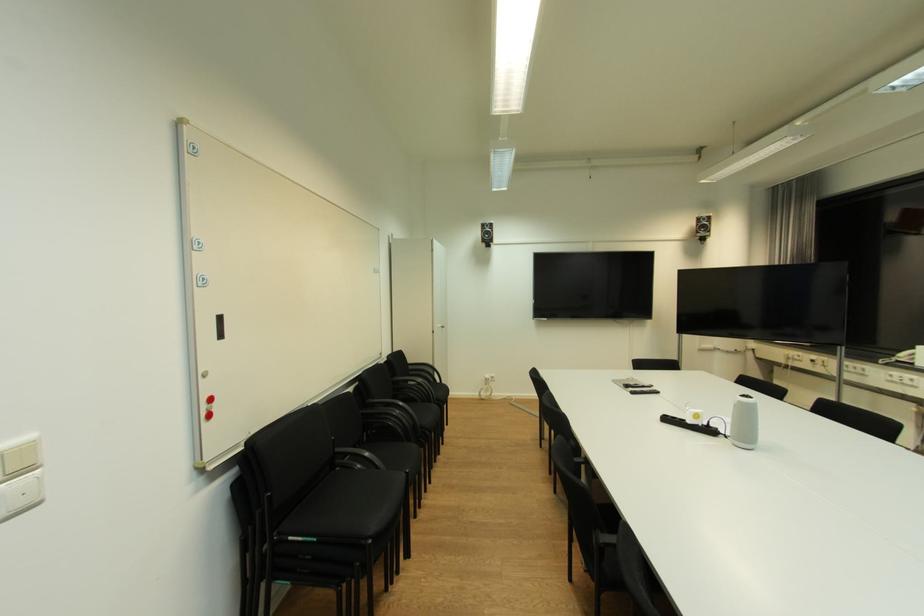
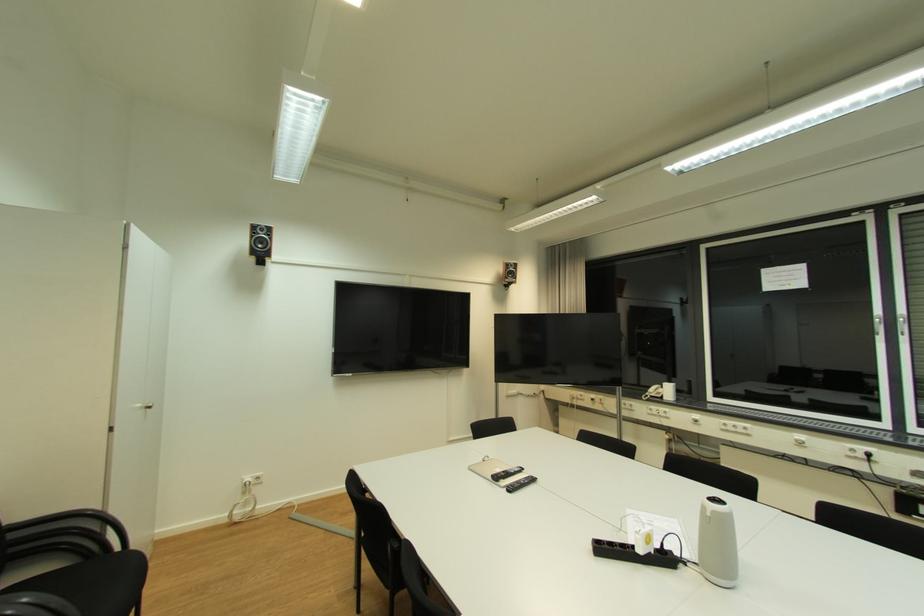
The point at [633,387] is marked in the first image. Where is the corresponding point in the second image?

(502, 479)